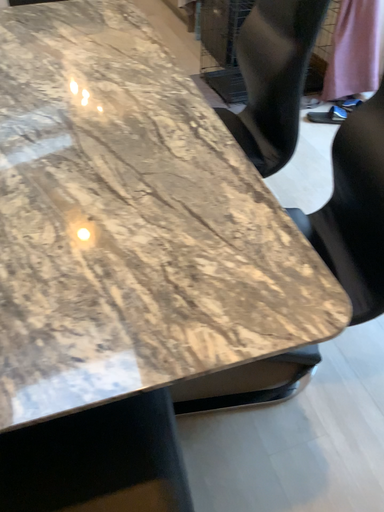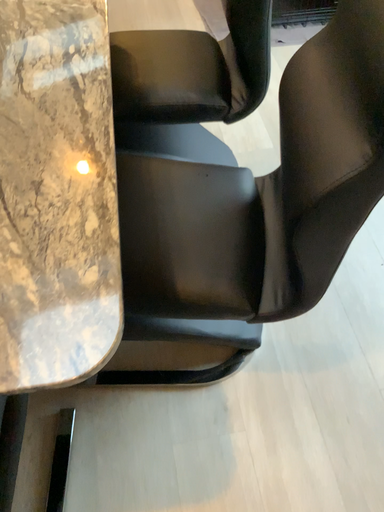
Question: Which way did the camera rotate in the video?

Choices:
 (A) rotated downward
 (B) rotated upward

Answer: (A)